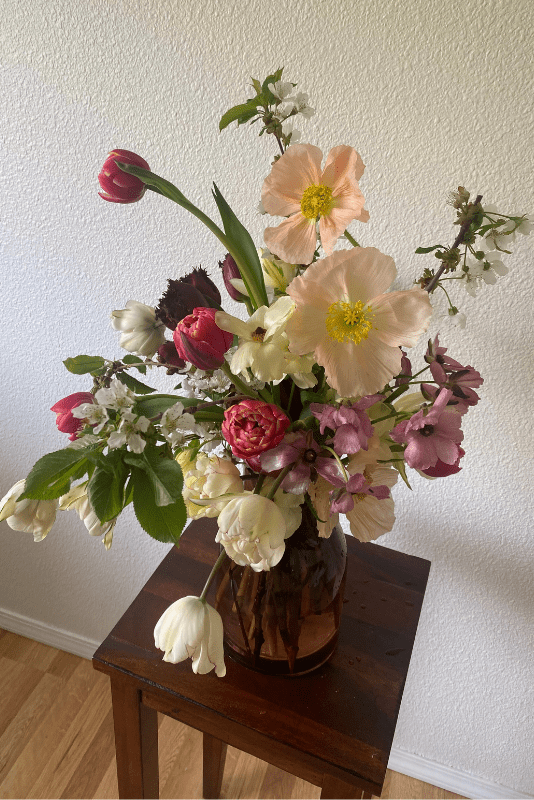
Find the location of a particular element. Image resolution: width=534 pixels, height=800 pixels. vase is located at coordinates [284, 588].